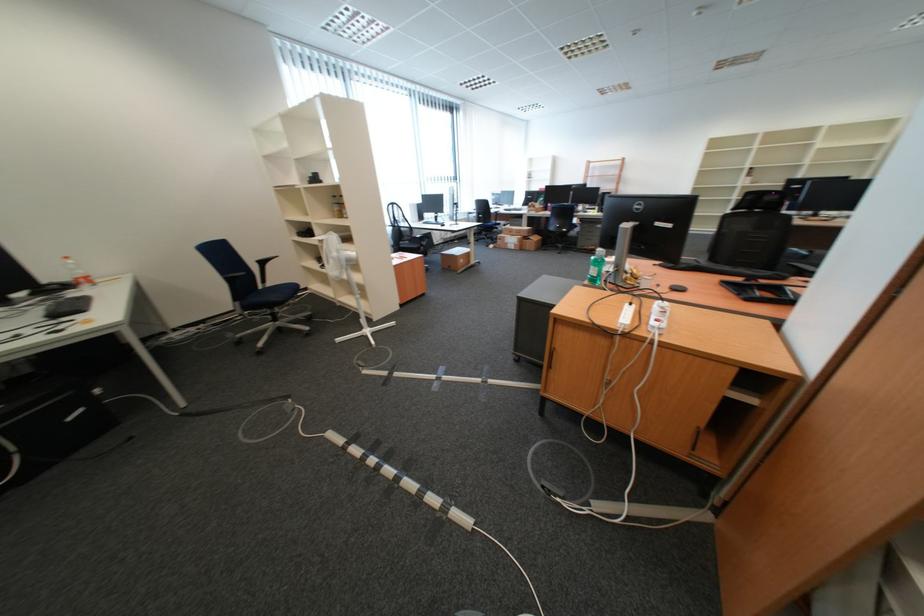
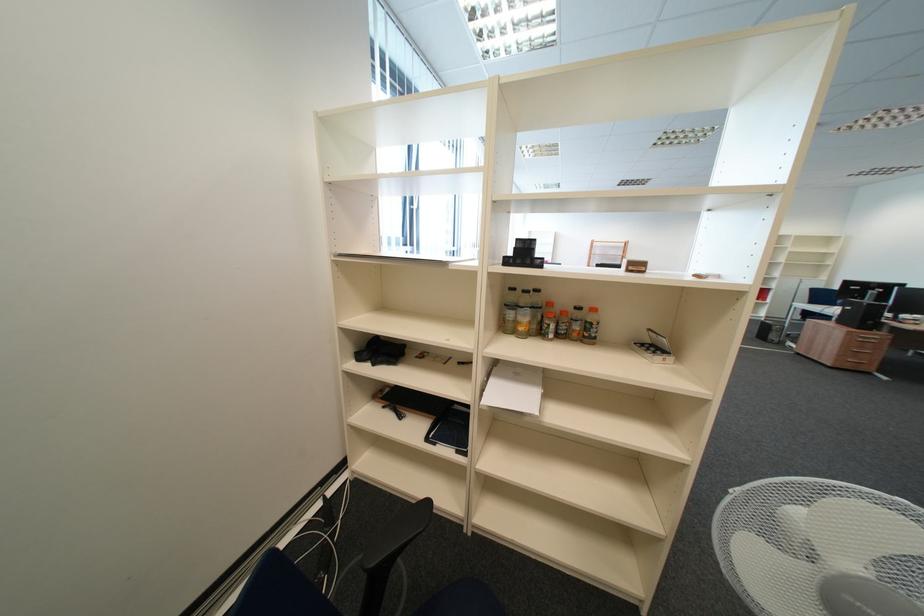
Which direction would the cameraman need to move to produce the second image?

The movement direction of the cameraman is left, forward.